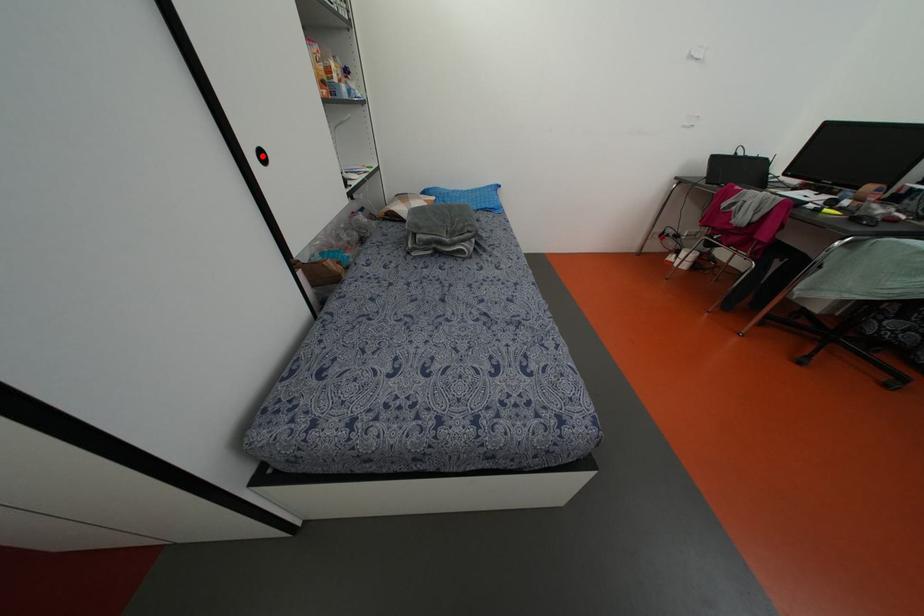
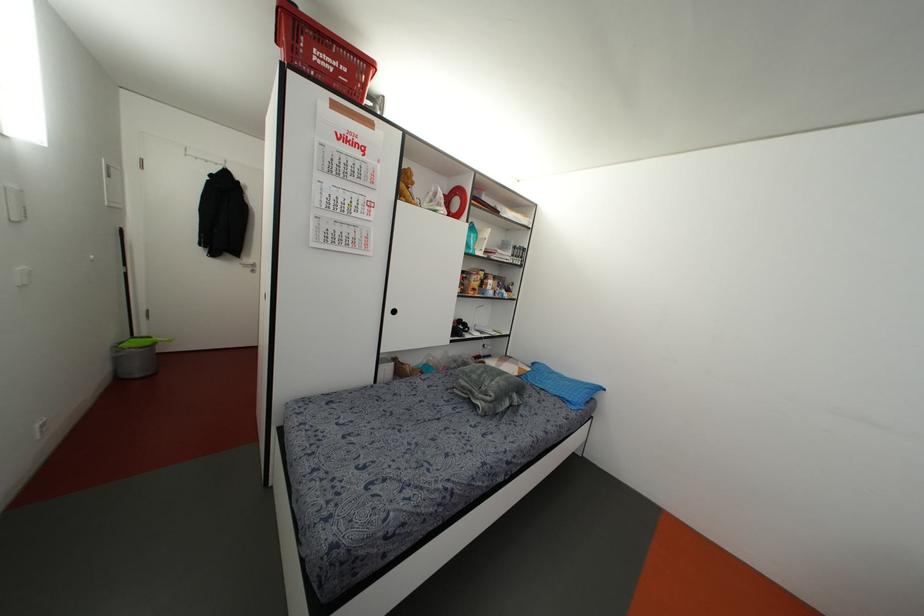
Locate, in the second image, the point that corresponds to the highlighted location in the first image.

(394, 310)